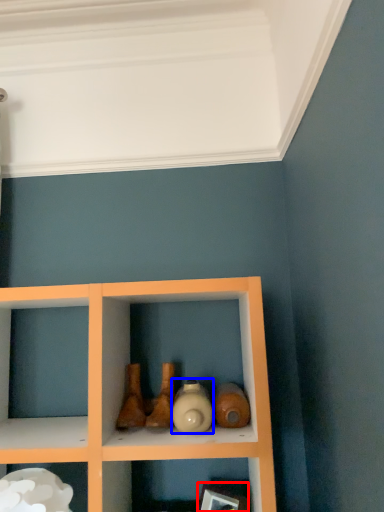
Question: Which point is further to the camera, picture frame (highlighted by a red box) or bottle (highlighted by a blue box)?

Choices:
 (A) picture frame
 (B) bottle

Answer: (A)